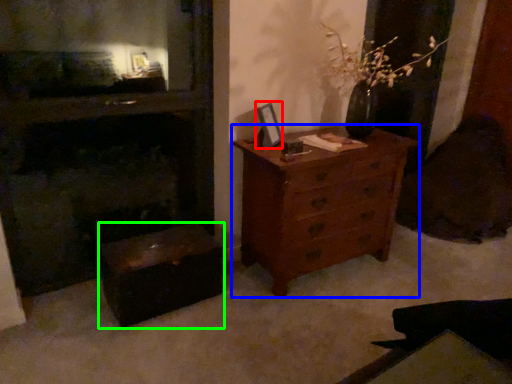
Question: Which is farther away from picture frame (highlighted by a red box)? chest of drawers (highlighted by a blue box) or vanity (highlighted by a green box)?

Choices:
 (A) chest of drawers
 (B) vanity

Answer: (B)